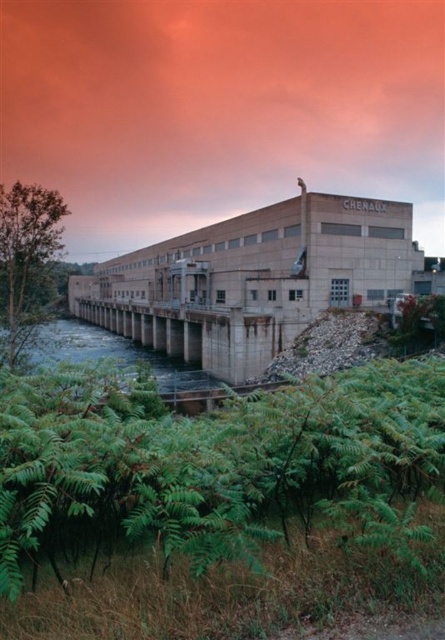
Is green leafy shrubs at lower left above clear concrete dam at center?

Indeed, green leafy shrubs at lower left is positioned over clear concrete dam at center.

Does green leafy shrubs at lower left have a lesser height compared to clear concrete dam at center?

Indeed, green leafy shrubs at lower left has a lesser height compared to clear concrete dam at center.

The height and width of the screenshot is (640, 445). What do you see at coordinates (205, 460) in the screenshot?
I see `green leafy shrubs at lower left` at bounding box center [205, 460].

The width and height of the screenshot is (445, 640). In order to click on green leafy shrubs at lower left in this screenshot , I will do `click(205, 460)`.